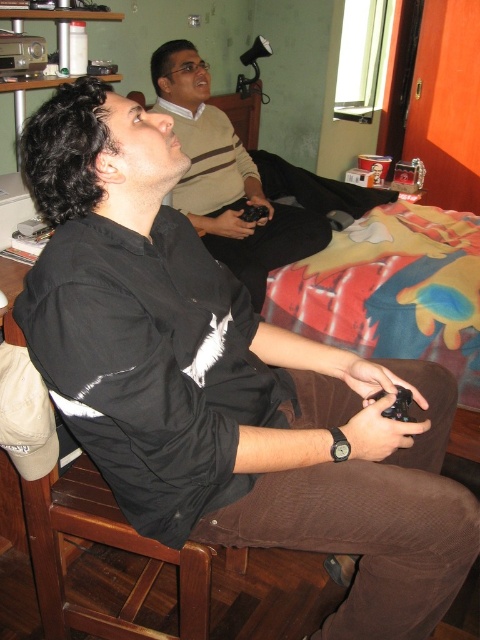
Looking at this image, you are a delivery robot with a box that is 1.2 meters wide. You need to move from the entrance to the living room where the black matte shirt at upper left and the black matte game controller at lower center are located. Can you pass through the space between them without tilting the box?

The distance between the black matte shirt at upper left and the black matte game controller at lower center is 1.24 meters. Since your box is 1.2 meters wide, you can pass through the space between them without tilting the box because the distance is slightly wider than the box.

You are a photographer trying to capture a closeup of the black matte game controller at lower center without including the black matte shirt at upper left in the frame. Based on their positions, is this possible?

The black matte shirt at upper left is positioned on the left side of black matte game controller at lower center. Since the shirt is to the left of the controller, you can adjust the camera angle to the right to exclude the shirt while keeping the controller in view.

You are a photographer standing in front of the scene. You want to take a closeup photo of the black matte shirt at upper left without moving the camera. Is it possible to do so?

The black matte shirt at upper left is 1.93 meters away from camera, so it is possible to take a closeup photo without moving the camera by using a zoom lens or adjusting the camera settings to focus on the shirt from that distance.